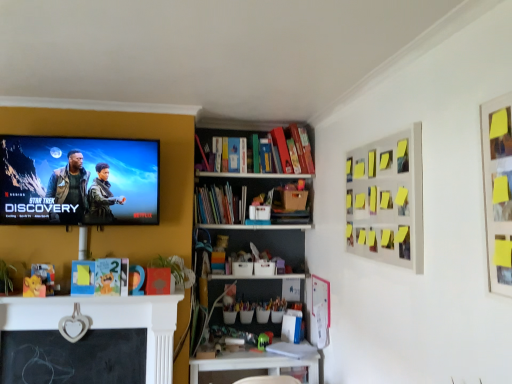
Question: Is white plastic table at lower center placed right next to yellow sticky notes at upper right?

Choices:
 (A) yes
 (B) no

Answer: (B)

Question: Is white plastic table at lower center facing away from yellow sticky notes at upper right?

Choices:
 (A) no
 (B) yes

Answer: (A)

Question: From a real-world perspective, does white plastic table at lower center sit lower than yellow sticky notes at upper right?

Choices:
 (A) yes
 (B) no

Answer: (A)

Question: Is white plastic table at lower center bigger than yellow sticky notes at upper right?

Choices:
 (A) no
 (B) yes

Answer: (B)

Question: Are white plastic table at lower center and yellow sticky notes at upper right far apart?

Choices:
 (A) yes
 (B) no

Answer: (A)

Question: From the image's perspective, relative to matte black screen at upper left, is white plastic table at lower center above or below?

Choices:
 (A) below
 (B) above

Answer: (A)

Question: Is point (241, 374) closer or farther from the camera than point (151, 140)?

Choices:
 (A) farther
 (B) closer

Answer: (A)

Question: Is white plastic table at lower center to the left or to the right of matte black screen at upper left in the image?

Choices:
 (A) right
 (B) left

Answer: (A)

Question: In terms of size, does white plastic table at lower center appear bigger or smaller than matte black screen at upper left?

Choices:
 (A) big
 (B) small

Answer: (A)

Question: Based on their sizes in the image, would you say white plastic table at lower center is bigger or smaller than yellow sticky notes at upper right?

Choices:
 (A) big
 (B) small

Answer: (A)

Question: Considering the relative positions of white plastic table at lower center and yellow sticky notes at upper right in the image provided, is white plastic table at lower center to the left or to the right of yellow sticky notes at upper right?

Choices:
 (A) right
 (B) left

Answer: (B)

Question: Considering the positions of white plastic table at lower center and yellow sticky notes at upper right in the image, is white plastic table at lower center wider or thinner than yellow sticky notes at upper right?

Choices:
 (A) thin
 (B) wide

Answer: (B)

Question: Does point (292, 362) appear closer or farther from the camera than point (352, 192)?

Choices:
 (A) farther
 (B) closer

Answer: (A)

Question: Based on their sizes in the image, would you say white plastic table at lower center is bigger or smaller than green plastic toy at lower center?

Choices:
 (A) small
 (B) big

Answer: (B)

Question: Visually, is white plastic table at lower center positioned to the left or to the right of green plastic toy at lower center?

Choices:
 (A) right
 (B) left

Answer: (B)